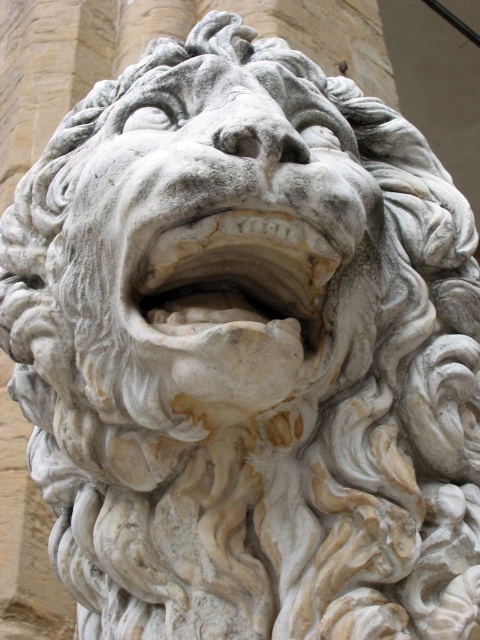
Can you confirm if white stone lion head at center is positioned to the left of white stone mouth at center?

Correct, you'll find white stone lion head at center to the left of white stone mouth at center.

Can you confirm if white stone lion head at center is positioned to the right of white stone mouth at center?

Incorrect, white stone lion head at center is not on the right side of white stone mouth at center.

What do you see at coordinates (204, 234) in the screenshot? I see `white stone lion head at center` at bounding box center [204, 234].

What are the coordinates of `white stone lion head at center` in the screenshot? It's located at (204, 234).